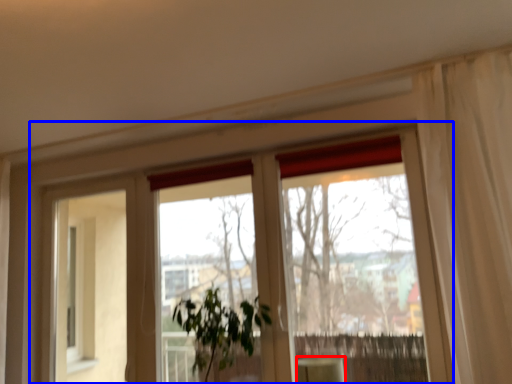
Question: Which of the following is the closest to the observer, furniture (highlighted by a red box) or window (highlighted by a blue box)?

Choices:
 (A) furniture
 (B) window

Answer: (A)